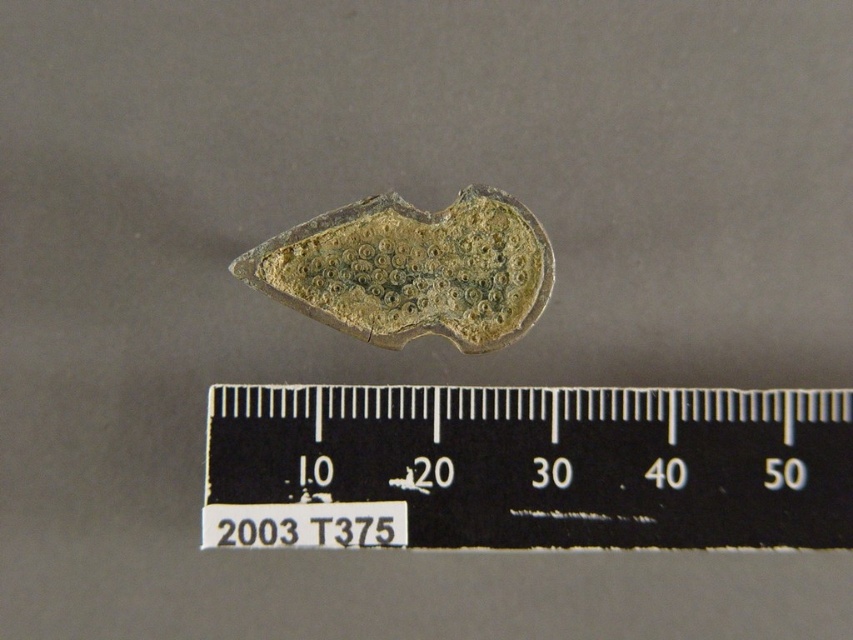
You are examining the object shown in the image. From your perspective, which of the two points, point (840, 468) or point (537, 292), appears closer to you?

Point (840, 468) is closer to the camera than point (537, 292).

You are an archaeologist examining the image. You need to determine the position of the black plastic ruler at center relative to the green patina metal at center. Which object is closer to you?

The black plastic ruler at center is closer to you because it is in front of the green patina metal at center.